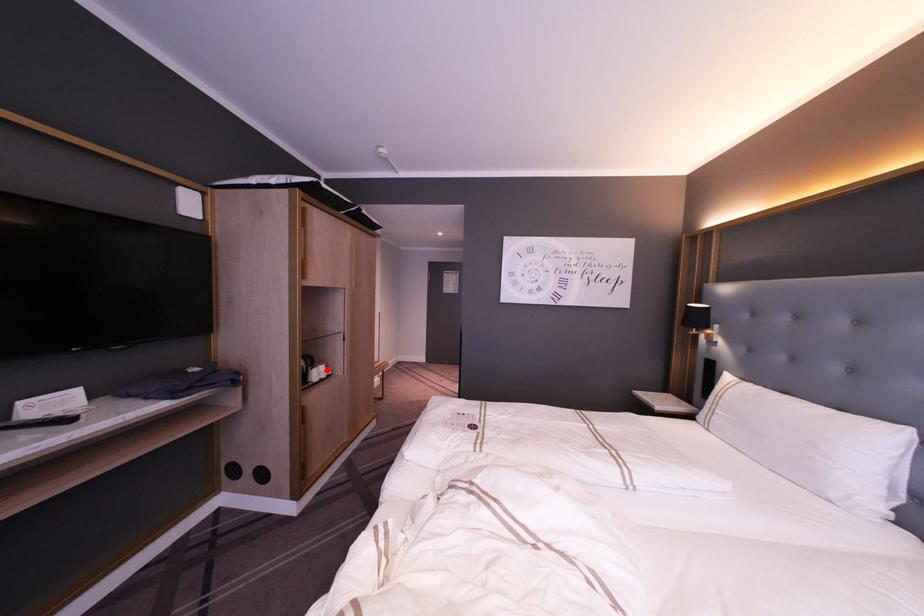
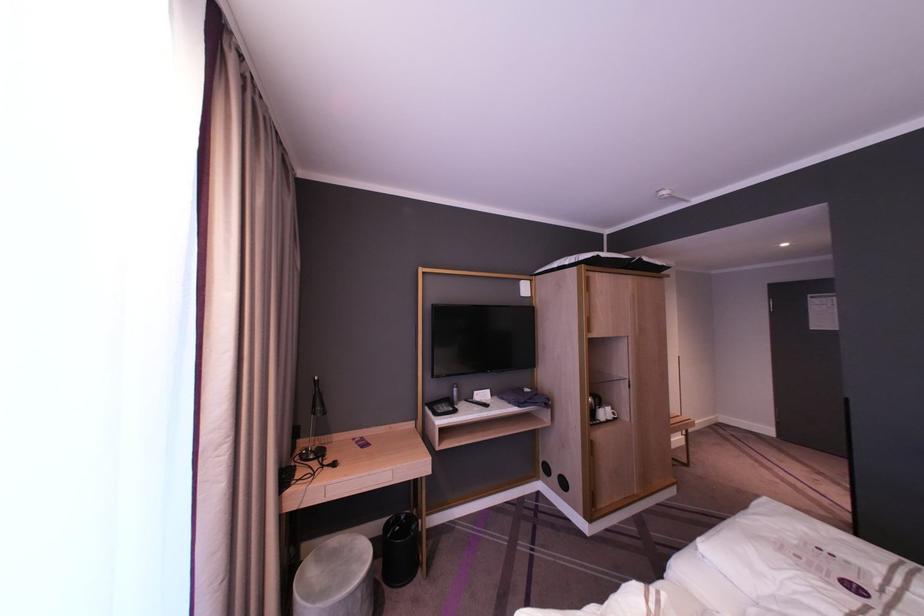
Locate, in the second image, the point that corresponds to the highlighted location in the first image.

(613, 413)